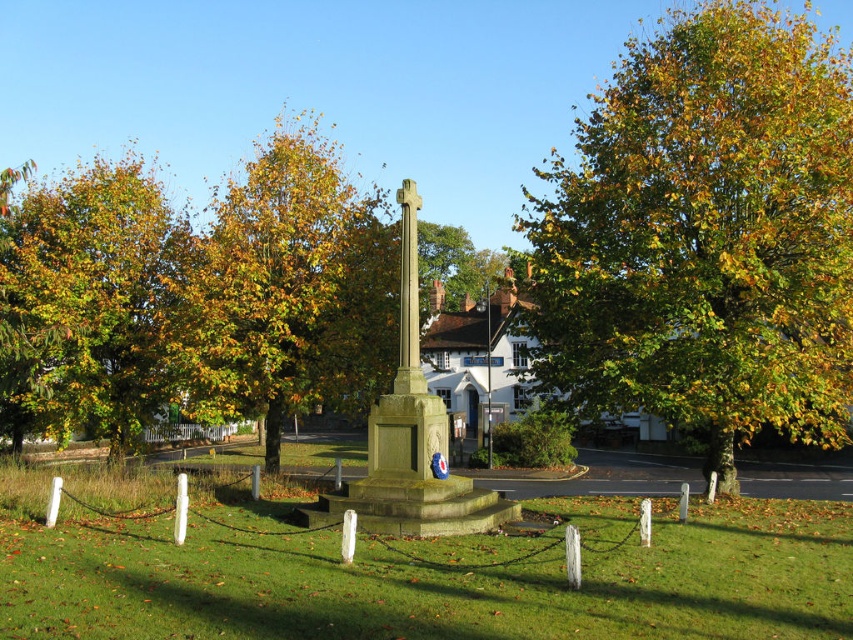
From the picture: Measure the distance from yellow-green leaves at upper right to golden leafy tree at left.

yellow-green leaves at upper right and golden leafy tree at left are 22.38 meters apart from each other.

Between yellow-green leaves at upper right and golden leafy tree at left, which one is positioned lower?

golden leafy tree at left is below.

Is point (759, 99) behind point (102, 330)?

That is False.

Identify the location of yellow-green leaves at upper right. This screenshot has height=640, width=853. (706, 234).

Describe the element at coordinates (410, 442) in the screenshot. I see `granite cross at center` at that location.

This screenshot has width=853, height=640. In order to click on granite cross at center in this screenshot , I will do `click(410, 442)`.

Locate an element on the screen. The width and height of the screenshot is (853, 640). granite cross at center is located at coordinates (410, 442).

Is yellow-green leaves at upper right further to the viewer compared to smooth stone cross at center?

Yes, it is.

Is point (640, 237) farther from camera compared to point (422, 388)?

That is True.

Find the location of a particular element. yellow-green leaves at upper right is located at coordinates (706, 234).